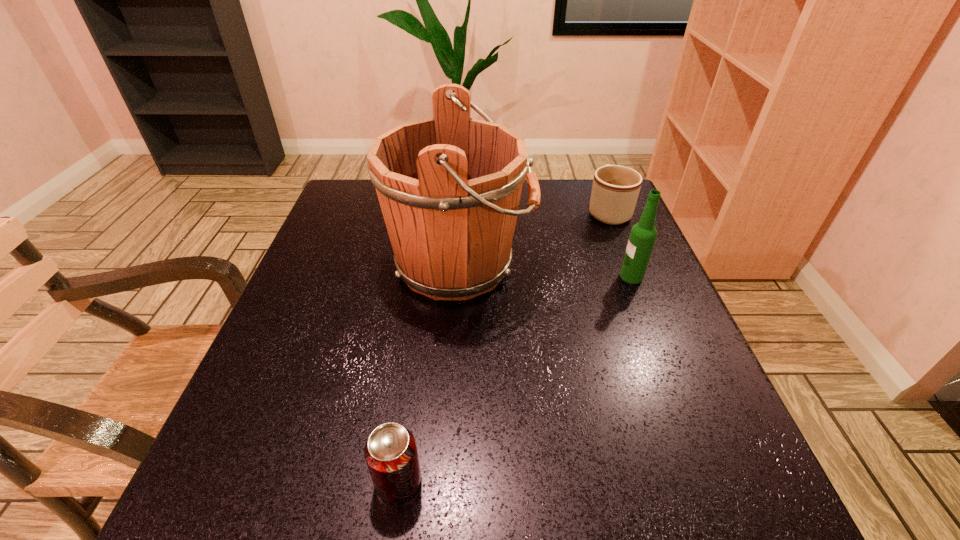
The image size is (960, 540). Find the location of `free region at the near left corner of the desktop`. free region at the near left corner of the desktop is located at coordinates 203,525.

The width and height of the screenshot is (960, 540). In order to click on vacant space that's between the mug and the nearest object in this screenshot , I will do `click(503, 346)`.

Identify the location of free space between the mug and the beer bottle. The height and width of the screenshot is (540, 960). (620, 244).

This screenshot has height=540, width=960. In order to click on free spot between the mug and the nearest object in this screenshot , I will do `click(503, 346)`.

You are a GUI agent. You are given a task and a screenshot of the screen. Output one action in this format:
    pyautogui.click(x=<x>, y=<y>)
    Task: Click on the vacant area between the mug and the bucket
    The height and width of the screenshot is (540, 960).
    Given the screenshot: What is the action you would take?
    pyautogui.click(x=535, y=238)

Image resolution: width=960 pixels, height=540 pixels. What are the coordinates of `vacant space in between the bucket and the nearest object` in the screenshot? It's located at (429, 372).

This screenshot has height=540, width=960. What are the coordinates of `free space between the soda can and the tallest object` in the screenshot? It's located at point(429,372).

The width and height of the screenshot is (960, 540). In order to click on free space between the beer bottle and the tallest object in this screenshot , I will do `click(546, 270)`.

You are a GUI agent. You are given a task and a screenshot of the screen. Output one action in this format:
    pyautogui.click(x=<x>, y=<y>)
    Task: Click on the vacant area that lies between the bucket and the soda can
    This screenshot has width=960, height=540.
    Given the screenshot: What is the action you would take?
    pyautogui.click(x=429, y=372)

This screenshot has width=960, height=540. I want to click on empty space that is in between the tallest object and the beer bottle, so click(x=546, y=270).